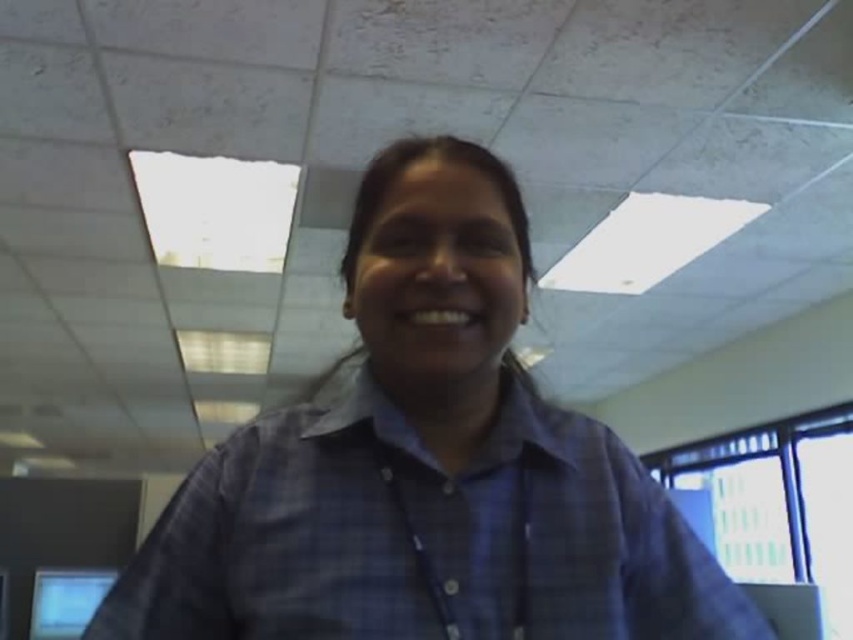
Question: Can you confirm if blue plaid shirt at center is smaller than matte black monitor at lower left?

Choices:
 (A) no
 (B) yes

Answer: (A)

Question: Does blue plaid shirt at center have a lesser width compared to matte black monitor at lower left?

Choices:
 (A) no
 (B) yes

Answer: (A)

Question: Does blue plaid shirt at center have a greater width compared to matte black monitor at lower left?

Choices:
 (A) yes
 (B) no

Answer: (A)

Question: Which point is closer to the camera?

Choices:
 (A) (48, 598)
 (B) (605, 620)

Answer: (B)